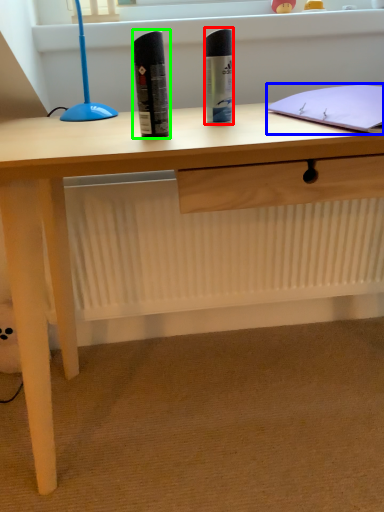
Question: Considering the real-world distances, which object is closest to stationery (highlighted by a red box)? notebook (highlighted by a blue box) or stationery (highlighted by a green box).

Choices:
 (A) notebook
 (B) stationery

Answer: (B)